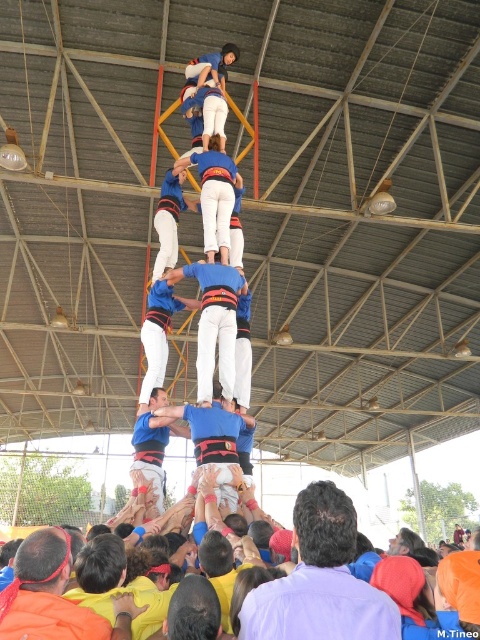
Question: Can you confirm if purple shirt at center is smaller than blue fabric pants at center?

Choices:
 (A) no
 (B) yes

Answer: (B)

Question: Does purple shirt at center have a greater width compared to blue fabric pants at center?

Choices:
 (A) no
 (B) yes

Answer: (A)

Question: Among these objects, which one is farthest from the camera?

Choices:
 (A) blue fabric pants at center
 (B) purple shirt at center

Answer: (A)

Question: Can you confirm if purple shirt at center is positioned below blue fabric pants at center?

Choices:
 (A) yes
 (B) no

Answer: (A)